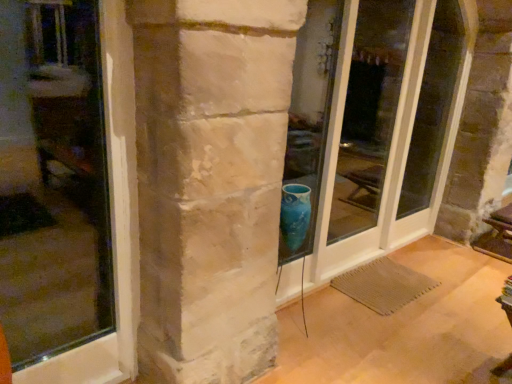
Identify the location of empty space that is to the right of white glossy door at center. (410, 280).